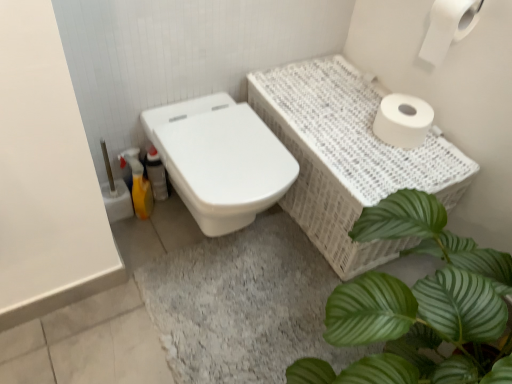
How much space does white matte toilet paper at upper right, the first toilet paper when ordered from top to bottom, occupy horizontally?

It is 12.40 centimeters.

Image resolution: width=512 pixels, height=384 pixels. What do you see at coordinates (402, 120) in the screenshot?
I see `white matte toilet paper at upper right, which appears as the first toilet paper when ordered from the bottom` at bounding box center [402, 120].

What is the approximate height of yellow plastic bottle at lower left?

yellow plastic bottle at lower left is 11.12 inches tall.

The image size is (512, 384). Describe the element at coordinates (220, 160) in the screenshot. I see `white glossy toilet at center` at that location.

Describe the element at coordinates (347, 157) in the screenshot. I see `white wicker basket at upper right` at that location.

Find the location of `white matte toilet paper at upper right, positioned as the 2th toilet paper in bottom-to-top order`. white matte toilet paper at upper right, positioned as the 2th toilet paper in bottom-to-top order is located at coordinates (448, 27).

Are white wicker basket at upper right and white matte toilet paper at upper right, the second toilet paper from the top, located far from each other?

No, white wicker basket at upper right is not far away from white matte toilet paper at upper right, the second toilet paper from the top.

Measure the distance between white wicker basket at upper right and white matte toilet paper at upper right, which appears as the first toilet paper when ordered from the bottom.

A distance of 8.75 inches exists between white wicker basket at upper right and white matte toilet paper at upper right, which appears as the first toilet paper when ordered from the bottom.

Based on their sizes in the image, would you say white wicker basket at upper right is bigger or smaller than white matte toilet paper at upper right, which appears as the first toilet paper when ordered from the bottom?

In the image, white wicker basket at upper right appears to be larger than white matte toilet paper at upper right, which appears as the first toilet paper when ordered from the bottom.

Is white wicker basket at upper right aimed at white matte toilet paper at upper right, which appears as the first toilet paper when ordered from the bottom?

No, white wicker basket at upper right is not oriented towards white matte toilet paper at upper right, which appears as the first toilet paper when ordered from the bottom.

In the scene shown: Is white wicker basket at upper right positioned far away from green leafy plant at lower right?

No, white wicker basket at upper right is not far from green leafy plant at lower right.

Considering the sizes of white wicker basket at upper right and green leafy plant at lower right in the image, is white wicker basket at upper right wider or thinner than green leafy plant at lower right?

In the image, white wicker basket at upper right appears to be more narrow than green leafy plant at lower right.

From a real-world perspective, relative to green leafy plant at lower right, is white wicker basket at upper right vertically above or below?

white wicker basket at upper right is situated lower than green leafy plant at lower right in the real world.

From a real-world perspective, which object stands above the other?

In real-world perspective, white wicker basket at upper right is above.

Find the location of a particular element. The width and height of the screenshot is (512, 384). toilet in front of the white wicker basket at upper right is located at coordinates (220, 160).

Who is smaller, white glossy toilet at center or white wicker basket at upper right?

white glossy toilet at center.

From a real-world perspective, which object stands above the other?

From a 3D spatial view, white glossy toilet at center is above.

Between white glossy toilet at center and translucent plastic bottle at lower left, which one has less height?

translucent plastic bottle at lower left.

Which is more to the right, white glossy toilet at center or translucent plastic bottle at lower left?

From the viewer's perspective, white glossy toilet at center appears more on the right side.

From the image's perspective, is white glossy toilet at center below translucent plastic bottle at lower left?

Indeed, from the image's perspective, white glossy toilet at center is shown beneath translucent plastic bottle at lower left.

From the image's perspective, is white matte toilet paper at upper right, the first toilet paper when ordered from top to bottom, below translucent plastic bottle at lower left?

Incorrect, from the image's perspective, white matte toilet paper at upper right, the first toilet paper when ordered from top to bottom, is higher than translucent plastic bottle at lower left.

In the scene shown: From a real-world perspective, is white matte toilet paper at upper right, positioned as the 2th toilet paper in bottom-to-top order, physically located above or below translucent plastic bottle at lower left?

In terms of real-world spatial position, white matte toilet paper at upper right, positioned as the 2th toilet paper in bottom-to-top order, is above translucent plastic bottle at lower left.

Can you confirm if white matte toilet paper at upper right, the first toilet paper when ordered from top to bottom, is smaller than translucent plastic bottle at lower left?

No, white matte toilet paper at upper right, the first toilet paper when ordered from top to bottom, is not smaller than translucent plastic bottle at lower left.

Is white matte toilet paper at upper right, the first toilet paper when ordered from top to bottom, completely or partially outside of translucent plastic bottle at lower left?

That's correct, white matte toilet paper at upper right, the first toilet paper when ordered from top to bottom, is outside of translucent plastic bottle at lower left.

Is white matte toilet paper at upper right, positioned as the 2th toilet paper in bottom-to-top order, located outside white glossy toilet at center?

Yes, white matte toilet paper at upper right, positioned as the 2th toilet paper in bottom-to-top order, is located beyond the bounds of white glossy toilet at center.

Considering the positions of objects white matte toilet paper at upper right, positioned as the 2th toilet paper in bottom-to-top order, and white glossy toilet at center in the image provided, who is in front, white matte toilet paper at upper right, positioned as the 2th toilet paper in bottom-to-top order, or white glossy toilet at center?

white matte toilet paper at upper right, positioned as the 2th toilet paper in bottom-to-top order, is more forward.

Is white matte toilet paper at upper right, positioned as the 2th toilet paper in bottom-to-top order, aimed at white glossy toilet at center?

No, white matte toilet paper at upper right, positioned as the 2th toilet paper in bottom-to-top order, is not turned towards white glossy toilet at center.

Considering the sizes of objects white matte toilet paper at upper right, the first toilet paper when ordered from top to bottom, and white glossy toilet at center in the image provided, who is thinner, white matte toilet paper at upper right, the first toilet paper when ordered from top to bottom, or white glossy toilet at center?

Thinner between the two is white matte toilet paper at upper right, the first toilet paper when ordered from top to bottom.

Which is behind, translucent plastic bottle at lower left or white matte toilet paper at upper right, the second toilet paper from the top?

translucent plastic bottle at lower left is more distant.

Does point (152, 169) come behind point (397, 103)?

Yes, it is behind point (397, 103).

This screenshot has width=512, height=384. I want to click on counter top on the left of white matte toilet paper at upper right, the second toilet paper from the top, so click(x=347, y=157).

At what (x,y) coordinates should I click in order to perform the action: click on houseplant that is below the white wicker basket at upper right (from the image's perspective). Please return your answer as a coordinate pair (x, y). Looking at the image, I should click on (419, 305).

Which object lies nearer to the anchor point white glossy toilet at center, white matte toilet paper at upper right, the second toilet paper from the top, or white matte toilet paper at upper right, the first toilet paper when ordered from top to bottom?

white matte toilet paper at upper right, the second toilet paper from the top, lies closer to white glossy toilet at center than the other object.

Estimate the real-world distances between objects in this image. Which object is closer to white wicker basket at upper right, white glossy toilet at center or yellow plastic bottle at lower left?

Among the two, white glossy toilet at center is located nearer to white wicker basket at upper right.

Considering their positions, is white wicker basket at upper right positioned further to translucent plastic bottle at lower left than white glossy toilet at center?

Among the two, white wicker basket at upper right is located further to translucent plastic bottle at lower left.

When comparing their distances from translucent plastic bottle at lower left, does green leafy plant at lower right or white matte toilet paper at upper right, the second toilet paper from the top, seem further?

green leafy plant at lower right lies further to translucent plastic bottle at lower left than the other object.

Looking at the image, which one is located closer to white glossy toilet at center, green leafy plant at lower right or translucent plastic bottle at lower left?

Based on the image, translucent plastic bottle at lower left appears to be nearer to white glossy toilet at center.

Looking at the image, which one is located closer to white matte toilet paper at upper right, the first toilet paper when ordered from top to bottom, white matte toilet paper at upper right, which appears as the first toilet paper when ordered from the bottom, or translucent plastic bottle at lower left?

white matte toilet paper at upper right, which appears as the first toilet paper when ordered from the bottom.

From the image, which object appears to be nearer to white matte toilet paper at upper right, positioned as the 2th toilet paper in bottom-to-top order, translucent plastic bottle at lower left or yellow plastic bottle at lower left?

Among the two, translucent plastic bottle at lower left is located nearer to white matte toilet paper at upper right, positioned as the 2th toilet paper in bottom-to-top order.

Considering their positions, is white wicker basket at upper right positioned closer to white matte toilet paper at upper right, positioned as the 2th toilet paper in bottom-to-top order, than yellow plastic bottle at lower left?

white wicker basket at upper right.

Locate an element on the screen. The image size is (512, 384). toilet paper situated between yellow plastic bottle at lower left and white matte toilet paper at upper right, positioned as the 2th toilet paper in bottom-to-top order, from left to right is located at coordinates (402, 120).

Find the location of a particular element. Image resolution: width=512 pixels, height=384 pixels. toilet between yellow plastic bottle at lower left and white matte toilet paper at upper right, the second toilet paper from the top is located at coordinates (220, 160).

Image resolution: width=512 pixels, height=384 pixels. I want to click on toilet between green leafy plant at lower right and white matte toilet paper at upper right, the second toilet paper from the top, in the front-back direction, so click(x=220, y=160).

What are the coordinates of `counter top between translucent plastic bottle at lower left and white matte toilet paper at upper right, positioned as the 2th toilet paper in bottom-to-top order, in the horizontal direction` in the screenshot? It's located at (347, 157).